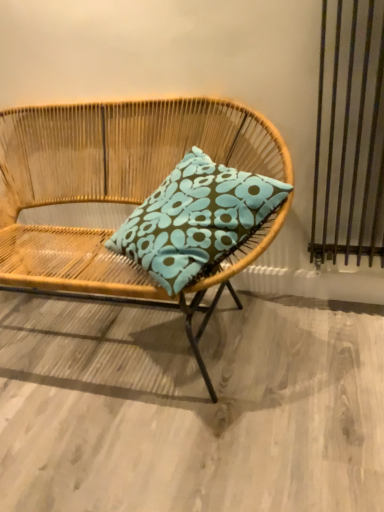
Locate an element on the screen. The width and height of the screenshot is (384, 512). woven wood chair at center is located at coordinates tap(110, 180).

In order to face woven wood chair at center, should I rotate leftwards or rightwards?

You should rotate left by 14.074 degrees.

Describe the element at coordinates (110, 180) in the screenshot. I see `woven wood chair at center` at that location.

Find the location of `teal fabric pillow at center`. teal fabric pillow at center is located at coordinates (196, 220).

Measure the distance between teal fabric pillow at center and camera.

A distance of 1.13 meters exists between teal fabric pillow at center and camera.

Image resolution: width=384 pixels, height=512 pixels. Describe the element at coordinates (196, 220) in the screenshot. I see `teal fabric pillow at center` at that location.

Locate an element on the screen. The height and width of the screenshot is (512, 384). woven wood chair at center is located at coordinates (110, 180).

Which object is positioned more to the left, woven wood chair at center or teal fabric pillow at center?

Positioned to the left is woven wood chair at center.

Is woven wood chair at center positioned behind teal fabric pillow at center?

No, it is not.

Is point (56, 285) closer to viewer compared to point (215, 223)?

No.

From the image's perspective, which is above, woven wood chair at center or teal fabric pillow at center?

teal fabric pillow at center, from the image's perspective.

From a real-world perspective, who is located higher, woven wood chair at center or teal fabric pillow at center?

teal fabric pillow at center is physically above.

Is woven wood chair at center wider or thinner than teal fabric pillow at center?

Considering their sizes, woven wood chair at center looks broader than teal fabric pillow at center.

Can you confirm if woven wood chair at center is taller than teal fabric pillow at center?

Indeed, woven wood chair at center has a greater height compared to teal fabric pillow at center.

Considering the relative sizes of woven wood chair at center and teal fabric pillow at center in the image provided, is woven wood chair at center bigger than teal fabric pillow at center?

Correct, woven wood chair at center is larger in size than teal fabric pillow at center.

Is woven wood chair at center inside or outside of teal fabric pillow at center?

woven wood chair at center is located beyond the bounds of teal fabric pillow at center.

Is woven wood chair at center next to teal fabric pillow at center?

No, woven wood chair at center is not touching teal fabric pillow at center.

Is woven wood chair at center oriented away from teal fabric pillow at center?

Yes, woven wood chair at center's orientation is away from teal fabric pillow at center.

You are a GUI agent. You are given a task and a screenshot of the screen. Output one action in this format:
    pyautogui.click(x=<x>, y=<y>)
    Task: Click on the chair in front of the teal fabric pillow at center
    
    Given the screenshot: What is the action you would take?
    pyautogui.click(x=110, y=180)

From the picture: In the image, is teal fabric pillow at center on the left side or the right side of woven wood chair at center?

teal fabric pillow at center is positioned on woven wood chair at center's right side.

Is teal fabric pillow at center behind woven wood chair at center?

Yes, teal fabric pillow at center is behind woven wood chair at center.

Does point (252, 220) come behind point (168, 136)?

No, it is not.

From the image's perspective, is teal fabric pillow at center located above woven wood chair at center?

Yes, from the image's perspective, teal fabric pillow at center is on top of woven wood chair at center.

Looking at this image, from a real-world perspective, which is physically below, teal fabric pillow at center or woven wood chair at center?

woven wood chair at center.

Considering the sizes of objects teal fabric pillow at center and woven wood chair at center in the image provided, who is thinner, teal fabric pillow at center or woven wood chair at center?

teal fabric pillow at center.

In terms of height, does teal fabric pillow at center look taller or shorter compared to woven wood chair at center?

Considering their sizes, teal fabric pillow at center has less height than woven wood chair at center.

Is teal fabric pillow at center bigger than woven wood chair at center?

No, teal fabric pillow at center is not bigger than woven wood chair at center.

Which is correct: teal fabric pillow at center is inside woven wood chair at center, or outside of it?

teal fabric pillow at center lies within the bounds of woven wood chair at center.

Are teal fabric pillow at center and woven wood chair at center far apart?

No, there isn't a large distance between teal fabric pillow at center and woven wood chair at center.

Is teal fabric pillow at center positioned with its back to woven wood chair at center?

Yes, woven wood chair at center is at the back of teal fabric pillow at center.

You are a GUI agent. You are given a task and a screenshot of the screen. Output one action in this format:
    pyautogui.click(x=<x>, y=<y>)
    Task: Click on the chair in front of the teal fabric pillow at center
    
    Given the screenshot: What is the action you would take?
    pyautogui.click(x=110, y=180)

Identify the location of chair in front of the teal fabric pillow at center. (110, 180).

The image size is (384, 512). Find the location of `pillow that is above the woven wood chair at center (from the image's perspective)`. pillow that is above the woven wood chair at center (from the image's perspective) is located at coordinates (196, 220).